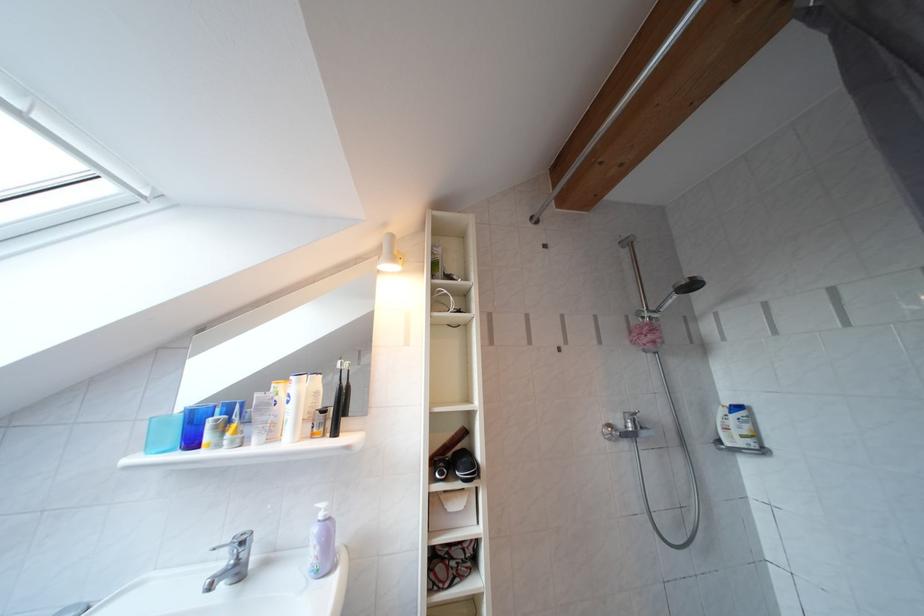
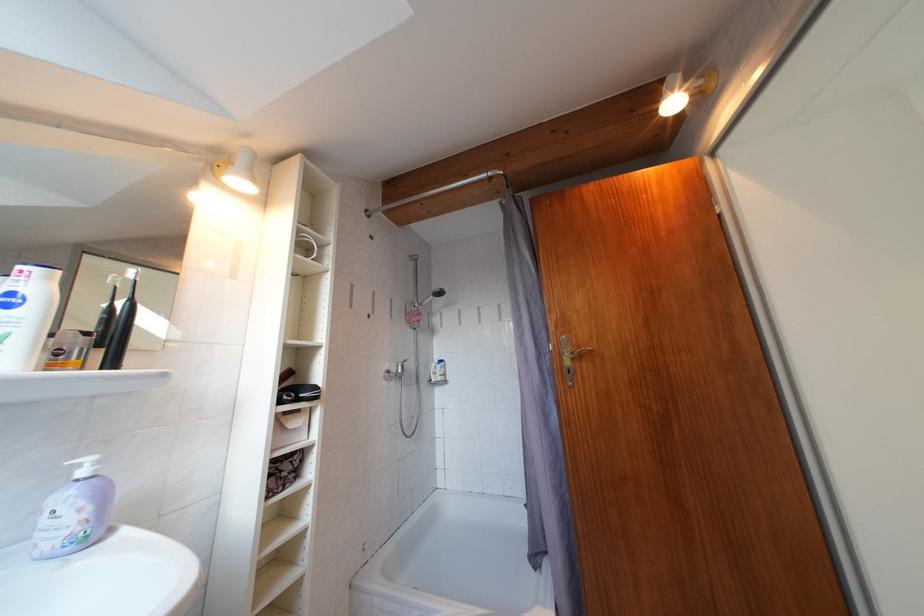
Find the pixel in the second image that matches point 307,387 in the first image.

(56, 283)